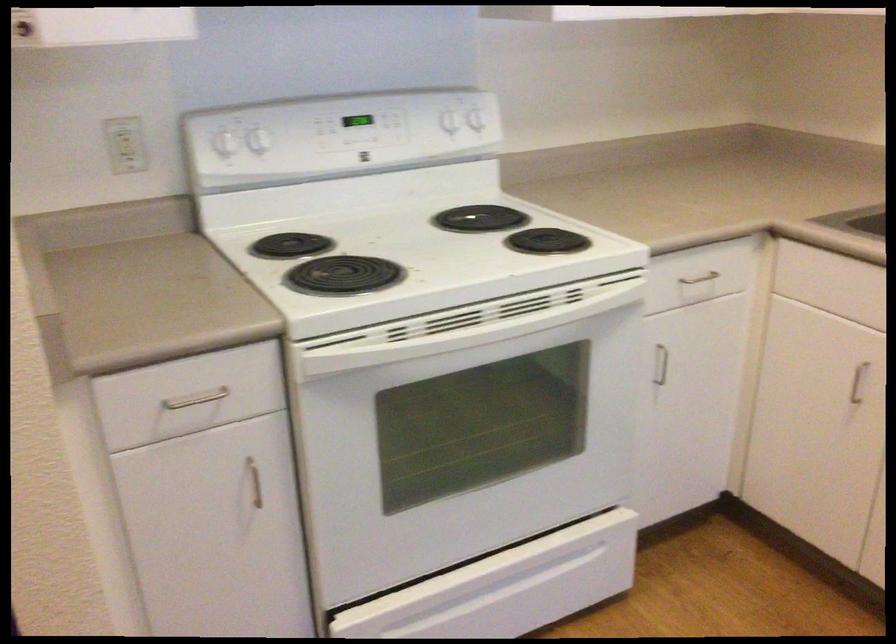
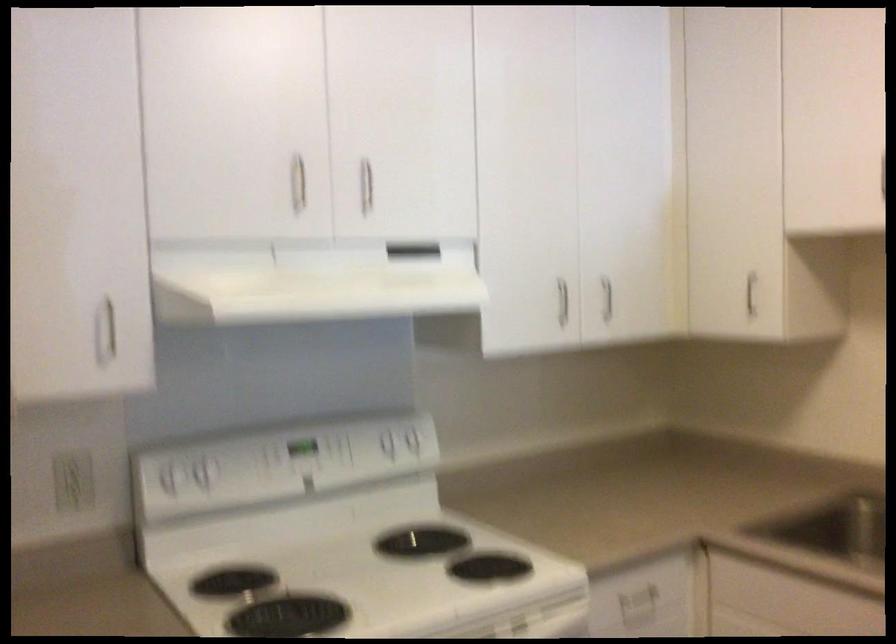
Question: Which direction would the cameraman need to move to produce the second image? Reply with the corresponding letter.

Choices:
 (A) Left
 (B) Right
 (C) Forward
 (D) Backward

Answer: (D)